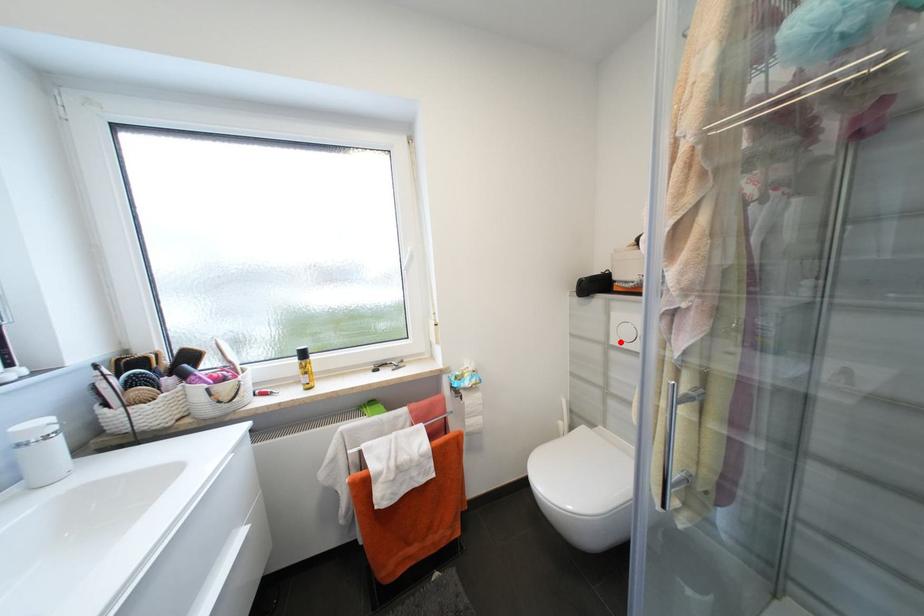
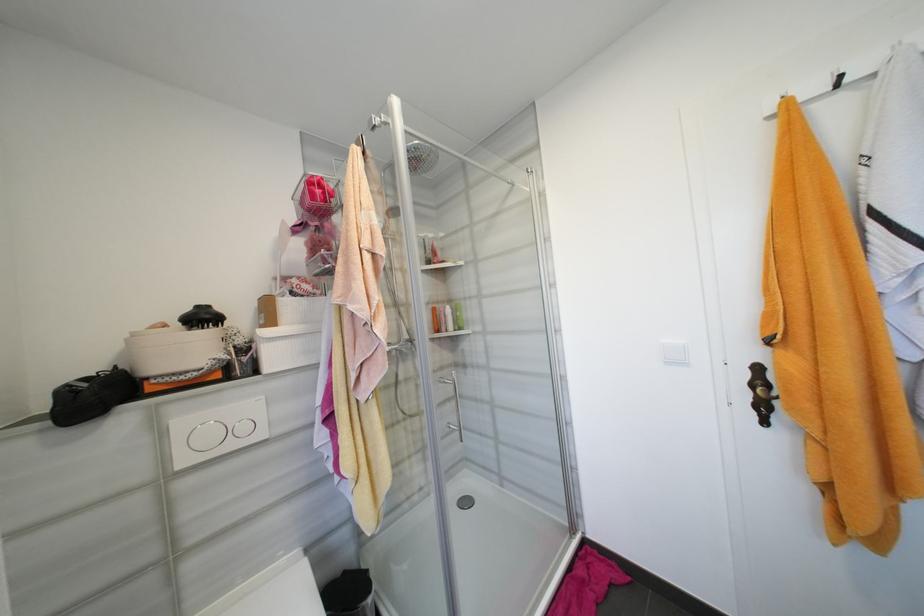
In the second image, find the point that corresponds to the highlighted location in the first image.

(189, 463)